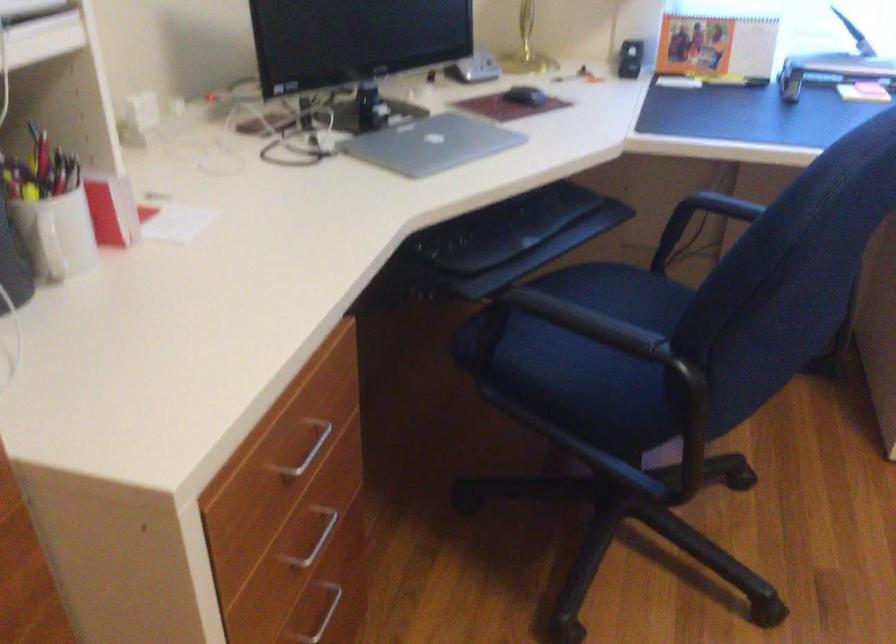
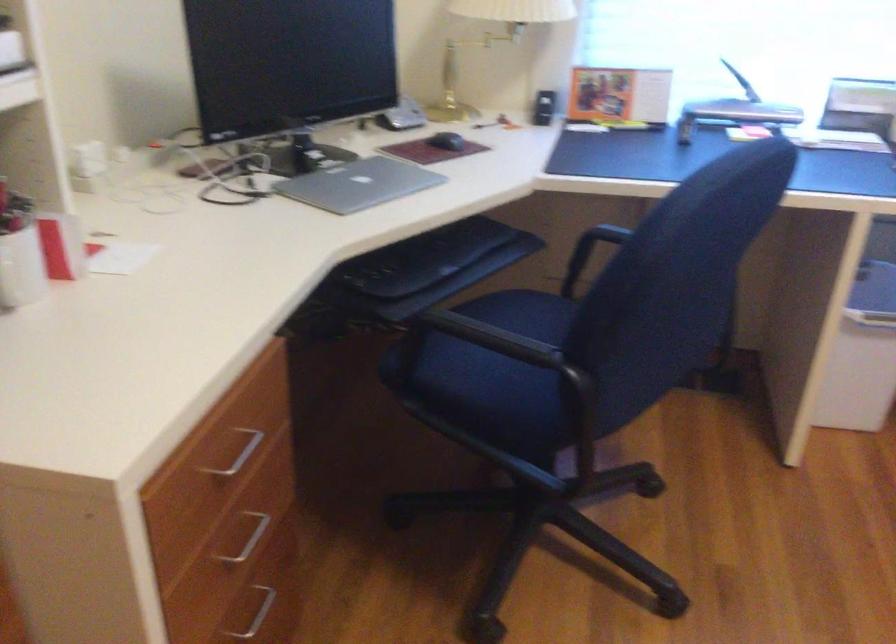
Where in the second image is the point corresponding to pixel 309 536 from the first image?

(247, 538)